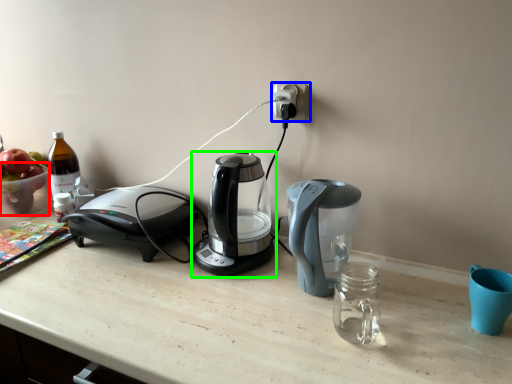
Question: Which is nearer to the bowl (highlighted by a red box)? power plugs and sockets (highlighted by a blue box) or coffee maker (highlighted by a green box).

Choices:
 (A) power plugs and sockets
 (B) coffee maker

Answer: (B)